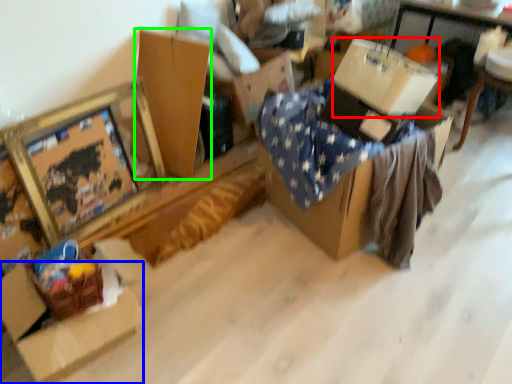
Question: Considering the real-world distances, which object is farthest from cardboard box (highlighted by a red box)? cardboard box (highlighted by a blue box) or cardboard box (highlighted by a green box)?

Choices:
 (A) cardboard box
 (B) cardboard box

Answer: (A)